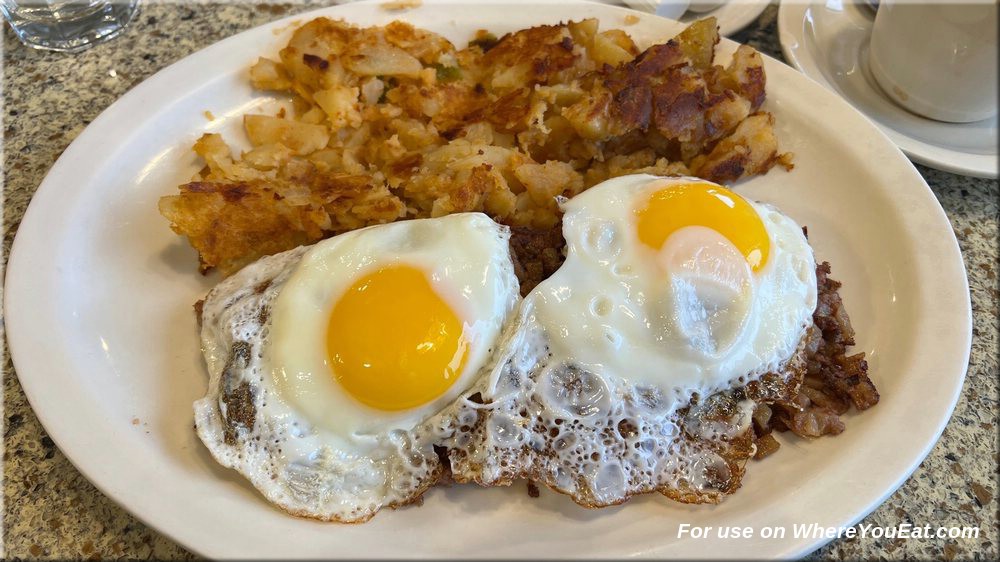
I want to click on mug, so tap(992, 49).